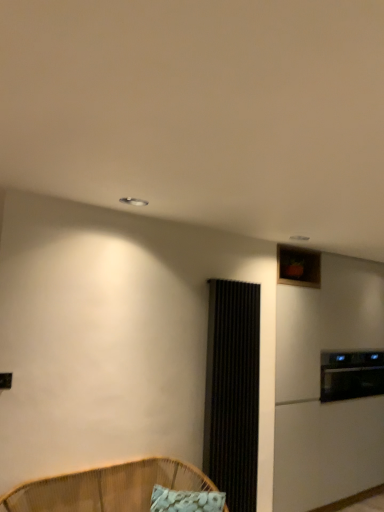
Question: From the image's perspective, is white fabric pillow at lower center below black textured screen door at center-right?

Choices:
 (A) yes
 (B) no

Answer: (A)

Question: Can you confirm if white fabric pillow at lower center is bigger than black textured screen door at center-right?

Choices:
 (A) no
 (B) yes

Answer: (A)

Question: Is white fabric pillow at lower center wider than black textured screen door at center-right?

Choices:
 (A) yes
 (B) no

Answer: (A)

Question: Could you tell me if white fabric pillow at lower center is turned towards black textured screen door at center-right?

Choices:
 (A) yes
 (B) no

Answer: (B)

Question: From the image's perspective, is white fabric pillow at lower center above black textured screen door at center-right?

Choices:
 (A) yes
 (B) no

Answer: (B)

Question: Are white fabric pillow at lower center and black textured screen door at center-right making contact?

Choices:
 (A) no
 (B) yes

Answer: (A)

Question: Can you confirm if woven bamboo chair at lower left is positioned to the left of white fabric pillow at lower center?

Choices:
 (A) yes
 (B) no

Answer: (A)

Question: Is woven bamboo chair at lower left looking in the opposite direction of white fabric pillow at lower center?

Choices:
 (A) yes
 (B) no

Answer: (A)

Question: Is woven bamboo chair at lower left located outside white fabric pillow at lower center?

Choices:
 (A) no
 (B) yes

Answer: (B)

Question: Can you confirm if woven bamboo chair at lower left is smaller than white fabric pillow at lower center?

Choices:
 (A) yes
 (B) no

Answer: (B)

Question: Does woven bamboo chair at lower left come behind white fabric pillow at lower center?

Choices:
 (A) no
 (B) yes

Answer: (A)

Question: Is woven bamboo chair at lower left at the right side of white fabric pillow at lower center?

Choices:
 (A) no
 (B) yes

Answer: (A)

Question: From the image's perspective, is black textured screen door at center-right over woven bamboo chair at lower left?

Choices:
 (A) yes
 (B) no

Answer: (A)